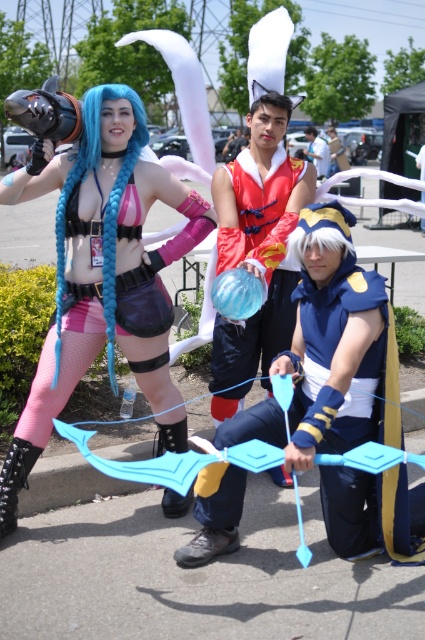
Question: Does blue fabric bow at center appear on the right side of shiny red fabric dress at center?

Choices:
 (A) no
 (B) yes

Answer: (B)

Question: Does blue fabric bow at center appear under shiny red fabric dress at center?

Choices:
 (A) yes
 (B) no

Answer: (A)

Question: Considering the real-world distances, which object is farthest from the matte blue hair at center?

Choices:
 (A) blue fabric bow at center
 (B) shiny red fabric dress at center

Answer: (A)

Question: Observing the image, what is the correct spatial positioning of blue fabric bow at center in reference to shiny red fabric dress at center?

Choices:
 (A) above
 (B) below

Answer: (B)

Question: Considering the real-world distances, which object is farthest from the shiny red fabric dress at center?

Choices:
 (A) matte blue hair at center
 (B) blue fabric bow at center

Answer: (B)

Question: Estimate the real-world distances between objects in this image. Which object is closer to the matte blue hair at center?

Choices:
 (A) blue fabric bow at center
 (B) shiny red fabric dress at center

Answer: (B)